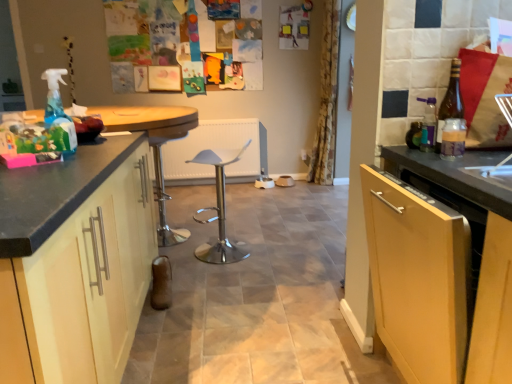
Image resolution: width=512 pixels, height=384 pixels. In order to click on vacant area that lies between polished silver bar stool at center, positioned as the 1th bar stool in right-to-left order, and polished chrome bar stool at center, the 1th bar stool from the left in this screenshot , I will do `click(195, 244)`.